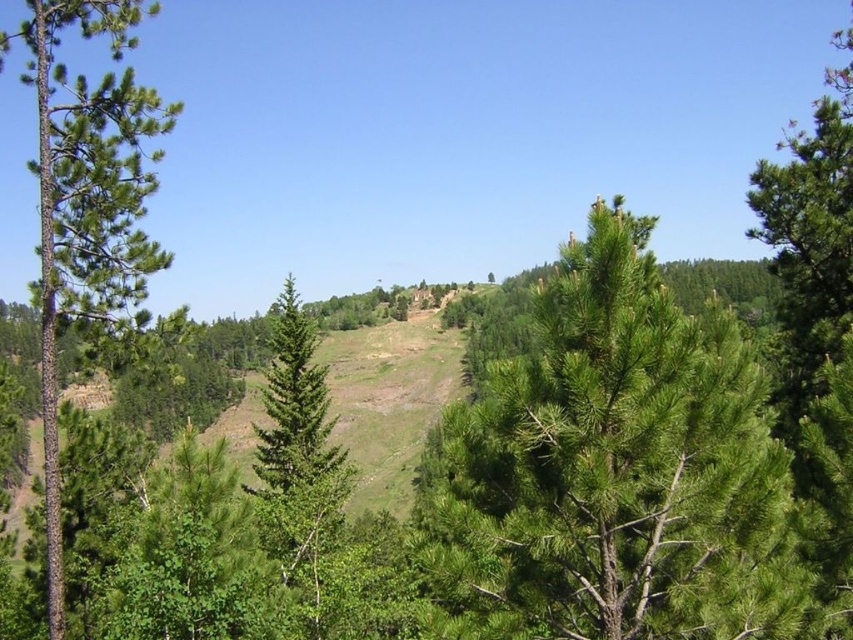
Between green needle-like tree at center and green rough bark tree at left, which one is positioned higher?

Positioned higher is green rough bark tree at left.

Is green needle-like tree at center positioned behind green rough bark tree at left?

No, green needle-like tree at center is closer to the viewer.

Between point (531, 355) and point (49, 454), which one is positioned in front?

Point (49, 454)

This screenshot has height=640, width=853. I want to click on green needle-like tree at center, so click(x=613, y=472).